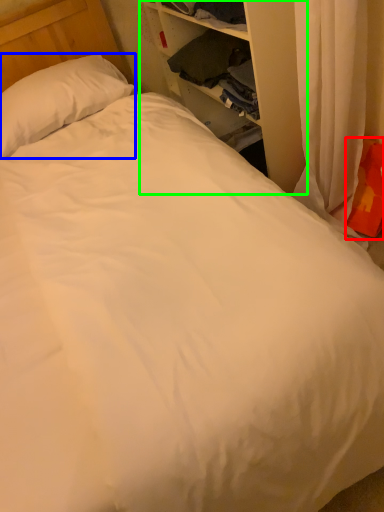
Question: Estimate the real-world distances between objects in this image. Which object is farther from pillow (highlighted by a red box), pillow (highlighted by a blue box) or dresser (highlighted by a green box)?

Choices:
 (A) pillow
 (B) dresser

Answer: (A)